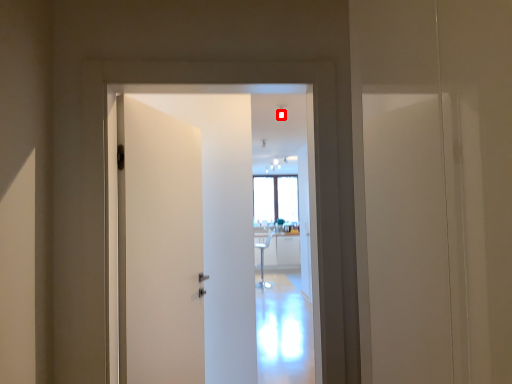
Question: Observing the image, what is the correct spatial positioning of light (annotated by the red box) in reference to door?

Choices:
 (A) right
 (B) left

Answer: (A)